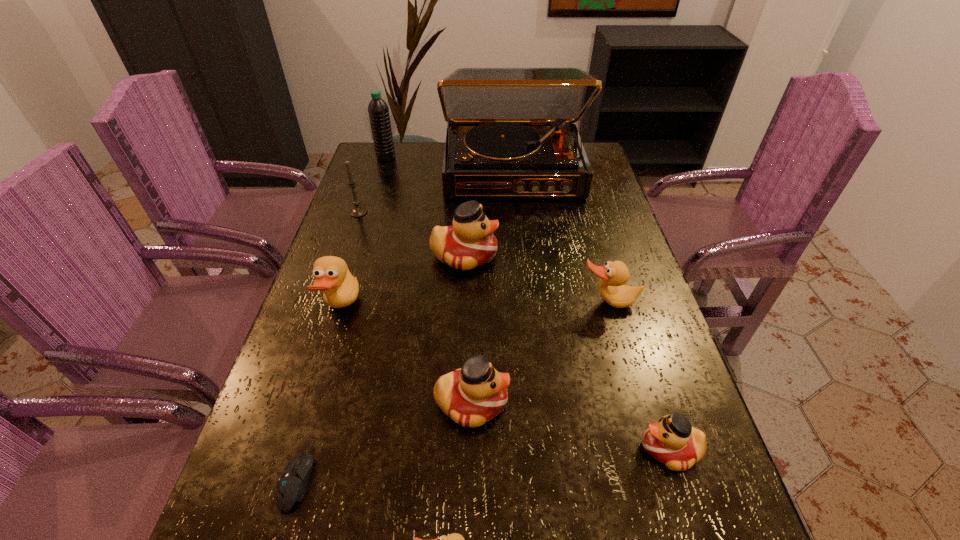
Image resolution: width=960 pixels, height=540 pixels. I want to click on the tallest object, so click(x=511, y=133).

Where is `the second tallest object`? the second tallest object is located at coordinates (378, 110).

This screenshot has width=960, height=540. I want to click on water bottle, so pyautogui.click(x=378, y=110).

The image size is (960, 540). In order to click on gray candle in this screenshot , I will do `click(358, 211)`.

At what (x,y) coordinates should I click in order to perform the action: click on candle. Please return your answer as a coordinate pair (x, y). This screenshot has height=540, width=960. Looking at the image, I should click on (358, 211).

Find the location of a particular element. The height and width of the screenshot is (540, 960). the farthest red duck is located at coordinates (469, 243).

At what (x,y) coordinates should I click in order to perform the action: click on the biggest red duck. Please return your answer as a coordinate pair (x, y). Looking at the image, I should click on (469, 243).

Find the location of a particular element. The height and width of the screenshot is (540, 960). the leftmost duck is located at coordinates [340, 288].

Image resolution: width=960 pixels, height=540 pixels. Find the location of `the biggest tan duck`. the biggest tan duck is located at coordinates (340, 288).

This screenshot has height=540, width=960. I want to click on the second smallest red duck, so click(x=476, y=393).